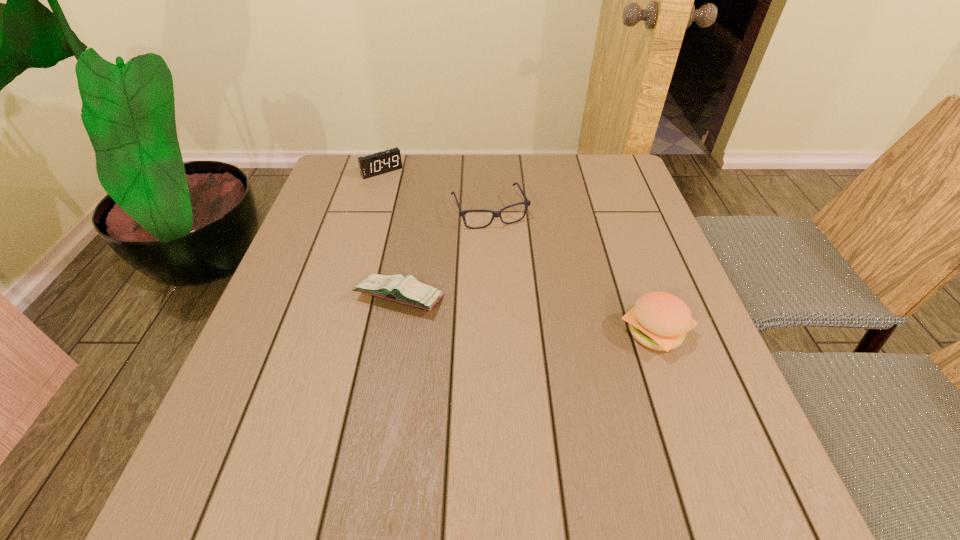
I want to click on diary, so click(x=407, y=290).

Find the location of a particular element. This screenshot has width=960, height=540. the rightmost object is located at coordinates (660, 321).

Image resolution: width=960 pixels, height=540 pixels. What are the coordinates of `hamburger` in the screenshot? It's located at (660, 321).

This screenshot has width=960, height=540. What are the coordinates of `the farthest object` in the screenshot? It's located at (371, 165).

At what (x,y) coordinates should I click in order to perform the action: click on spectacles. Please return your answer as a coordinate pair (x, y). This screenshot has height=540, width=960. Looking at the image, I should click on [527, 203].

Find the location of a particular element. vacant area situated 0.050m on the left of the diary is located at coordinates (333, 298).

Identify the location of vacant area located on the front of the rightmost object. (677, 396).

This screenshot has height=540, width=960. What are the coordinates of `blank space located on the front-facing side of the farthest object` in the screenshot? It's located at (414, 208).

The height and width of the screenshot is (540, 960). I want to click on free point located on the front-facing side of the farthest object, so click(x=426, y=224).

Locate an element on the screen. vacant space situated on the front-facing side of the farthest object is located at coordinates (445, 249).